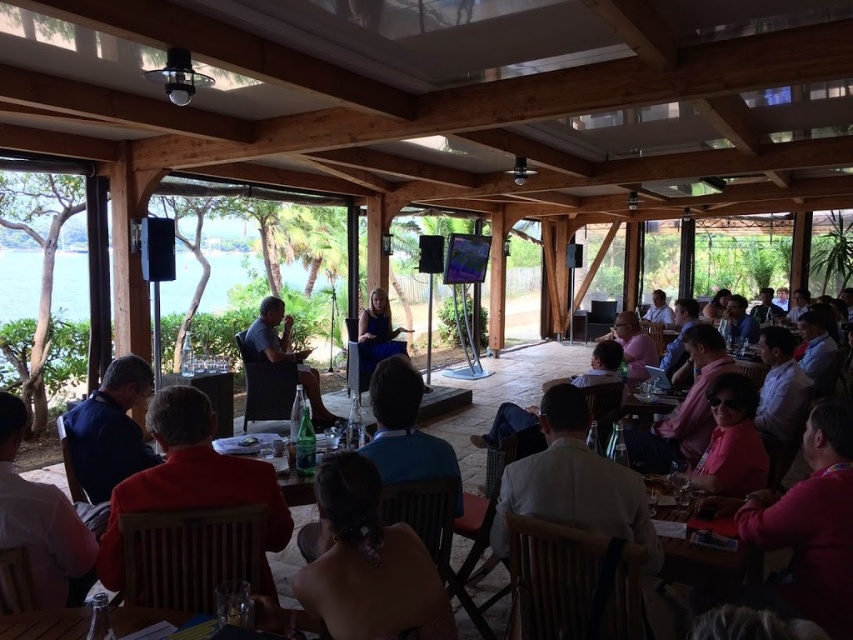
Locate an element on the screen. The image size is (853, 640). blue shirt at lower left is located at coordinates (109, 429).

The image size is (853, 640). Describe the element at coordinates (109, 429) in the screenshot. I see `blue shirt at lower left` at that location.

What are the coordinates of `blue shirt at lower left` in the screenshot? It's located at (109, 429).

Does blue shirt at lower left have a greater width compared to matte blue dress at center?

In fact, blue shirt at lower left might be narrower than matte blue dress at center.

Where is `blue shirt at lower left`? Image resolution: width=853 pixels, height=640 pixels. blue shirt at lower left is located at coordinates (109, 429).

Is clear glass table at lower center further to the viewer compared to clear plastic table at center?

No, it is in front of clear plastic table at center.

In the scene shown: Can you confirm if clear glass table at lower center is bigger than clear plastic table at center?

No.

Locate an element on the screen. clear glass table at lower center is located at coordinates (45, 625).